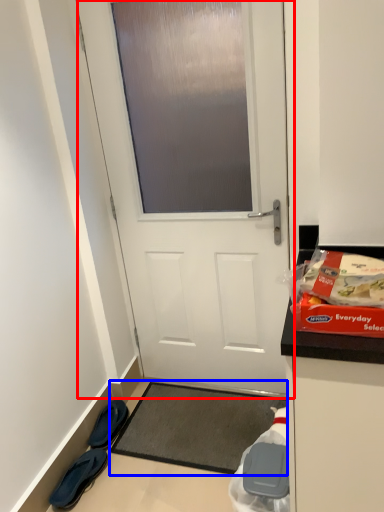
Question: Which object is further to the camera taking this photo, door (highlighted by a red box) or yoga mat (highlighted by a blue box)?

Choices:
 (A) door
 (B) yoga mat

Answer: (B)